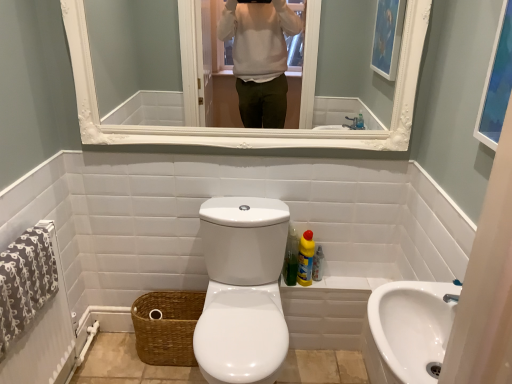
What do you see at coordinates (496, 83) in the screenshot? The height and width of the screenshot is (384, 512). I see `blue glass picture frame at upper right` at bounding box center [496, 83].

This screenshot has width=512, height=384. What do you see at coordinates (305, 259) in the screenshot? I see `yellow liquid cleaner at lower right` at bounding box center [305, 259].

Identify the location of yellow liquid cleaner at lower right. click(305, 259).

What is the approximate width of white glossy toilet at center?

white glossy toilet at center is 68.39 centimeters wide.

Where is `white glossy mirror at upper center`? white glossy mirror at upper center is located at coordinates (132, 48).

Image resolution: width=512 pixels, height=384 pixels. What do you see at coordinates (132, 48) in the screenshot?
I see `white glossy mirror at upper center` at bounding box center [132, 48].

I want to click on blue glass picture frame at upper right, so click(496, 83).

How far apart are yellow liquid cleaner at lower right and translucent plastic bottle at lower right?

3.25 inches.

Which object is wider, yellow liquid cleaner at lower right or translucent plastic bottle at lower right?

yellow liquid cleaner at lower right is wider.

Would you say yellow liquid cleaner at lower right is to the left or to the right of translucent plastic bottle at lower right in the picture?

Based on their positions, yellow liquid cleaner at lower right is located to the left of translucent plastic bottle at lower right.

From a real-world perspective, who is located higher, yellow liquid cleaner at lower right or translucent plastic bottle at lower right?

In real-world perspective, yellow liquid cleaner at lower right is above.

Relative to blue glass picture frame at upper right, is white glossy mirror at upper center in front or behind?

In the image, white glossy mirror at upper center appears behind blue glass picture frame at upper right.

Is white glossy mirror at upper center not close to blue glass picture frame at upper right?

Indeed, white glossy mirror at upper center is not near blue glass picture frame at upper right.

How many degrees apart are the facing directions of white glossy mirror at upper center and blue glass picture frame at upper right?

They differ by 90.3 degrees in their facing directions.

From the picture: Looking at their sizes, would you say white glossy mirror at upper center is wider or thinner than blue glass picture frame at upper right?

Considering their sizes, white glossy mirror at upper center looks broader than blue glass picture frame at upper right.

Is white glossy mirror at upper center with white glossy toilet at center?

white glossy mirror at upper center and white glossy toilet at center are not in contact.

The width and height of the screenshot is (512, 384). What are the coordinates of `toilet below the white glossy mirror at upper center (from the image's perspective)` in the screenshot? It's located at (242, 290).

From a real-world perspective, who is located lower, white glossy mirror at upper center or white glossy toilet at center?

white glossy toilet at center, from a real-world perspective.

Who is smaller, white glossy mirror at upper center or white glossy toilet at center?

Smaller between the two is white glossy mirror at upper center.

From their relative heights in the image, would you say white glossy mirror at upper center is taller or shorter than white glossy sink at lower right?

white glossy mirror at upper center is taller than white glossy sink at lower right.

Would you say white glossy sink at lower right is part of white glossy mirror at upper center's contents?

No, white glossy sink at lower right is located outside of white glossy mirror at upper center.

Considering the relative positions of white glossy mirror at upper center and white glossy sink at lower right in the image provided, is white glossy mirror at upper center to the left of white glossy sink at lower right from the viewer's perspective?

Yes.

Can you confirm if white glossy mirror at upper center is thinner than yellow liquid cleaner at lower right?

Correct, the width of white glossy mirror at upper center is less than that of yellow liquid cleaner at lower right.

Between white glossy mirror at upper center and yellow liquid cleaner at lower right, which one appears on the right side from the viewer's perspective?

From the viewer's perspective, yellow liquid cleaner at lower right appears more on the right side.

Can you confirm if white glossy mirror at upper center is smaller than yellow liquid cleaner at lower right?

Actually, white glossy mirror at upper center might be larger than yellow liquid cleaner at lower right.

Which object is positioned more to the left, blue glass picture frame at upper right or white glossy mirror at upper center?

From the viewer's perspective, white glossy mirror at upper center appears more on the left side.

Are blue glass picture frame at upper right and white glossy mirror at upper center located far from each other?

Absolutely, blue glass picture frame at upper right is distant from white glossy mirror at upper center.

Would you say blue glass picture frame at upper right is inside or outside white glossy mirror at upper center?

blue glass picture frame at upper right is not inside white glossy mirror at upper center, it's outside.

In terms of height, does yellow liquid cleaner at lower right look taller or shorter compared to white glossy mirror at upper center?

yellow liquid cleaner at lower right is shorter than white glossy mirror at upper center.

Is yellow liquid cleaner at lower right touching white glossy mirror at upper center?

There is a gap between yellow liquid cleaner at lower right and white glossy mirror at upper center.

Find the location of a particular element. cleaning product that appears on the right of white glossy mirror at upper center is located at coordinates (305, 259).

Does yellow liquid cleaner at lower right have a greater width compared to white glossy mirror at upper center?

Indeed, yellow liquid cleaner at lower right has a greater width compared to white glossy mirror at upper center.

You are a GUI agent. You are given a task and a screenshot of the screen. Output one action in this format:
    pyautogui.click(x=<x>, y=<y>)
    Task: Click on the toiletry on the right of yellow liquid cleaner at lower right
    
    Given the screenshot: What is the action you would take?
    pyautogui.click(x=318, y=264)

At what (x,y) coordinates should I click in order to perform the action: click on mirror that appears behind the blue glass picture frame at upper right. Please return your answer as a coordinate pair (x, y). The width and height of the screenshot is (512, 384). Looking at the image, I should click on (132, 48).

In the scene shown: Looking at the image, which one is located further to brown woven basket at lower left, white glossy toilet at center or yellow liquid cleaner at lower right?

yellow liquid cleaner at lower right lies further to brown woven basket at lower left than the other object.

Estimate the real-world distances between objects in this image. Which object is closer to yellow liquid cleaner at lower right, blue glass picture frame at upper right or white glossy sink at lower right?

white glossy sink at lower right lies closer to yellow liquid cleaner at lower right than the other object.

Looking at the image, which one is located closer to blue glass picture frame at upper right, yellow liquid cleaner at lower right or white glossy sink at lower right?

white glossy sink at lower right lies closer to blue glass picture frame at upper right than the other object.

Considering their positions, is blue glass picture frame at upper right positioned further to white glossy sink at lower right than translucent plastic bottle at lower right?

The object further to white glossy sink at lower right is translucent plastic bottle at lower right.

Estimate the real-world distances between objects in this image. Which object is closer to brown woven basket at lower left, blue glass picture frame at upper right or yellow liquid cleaner at lower right?

The object closer to brown woven basket at lower left is yellow liquid cleaner at lower right.

Consider the image. Looking at the image, which one is located closer to white glossy sink at lower right, translucent plastic bottle at lower right or blue glass picture frame at upper right?

blue glass picture frame at upper right is closer to white glossy sink at lower right.

Based on their spatial positions, is white glossy mirror at upper center or brown woven basket at lower left closer to translucent plastic bottle at lower right?

The object closer to translucent plastic bottle at lower right is brown woven basket at lower left.

Considering their positions, is brown woven basket at lower left positioned further to white glossy sink at lower right than translucent plastic bottle at lower right?

brown woven basket at lower left.

You are a GUI agent. You are given a task and a screenshot of the screen. Output one action in this format:
    pyautogui.click(x=<x>, y=<y>)
    Task: Click on the cleaning product between white glossy toilet at center and brown woven basket at lower left in the front-back direction
    The width and height of the screenshot is (512, 384).
    Given the screenshot: What is the action you would take?
    pyautogui.click(x=305, y=259)

Identify the location of toilet between blue glass picture frame at upper right and translucent plastic bottle at lower right from front to back. The height and width of the screenshot is (384, 512). (242, 290).

I want to click on toilet between white glossy sink at lower right and brown woven basket at lower left in the front-back direction, so click(242, 290).

At what (x,y) coordinates should I click in order to perform the action: click on cleaning product between white glossy sink at lower right and brown woven basket at lower left along the z-axis. Please return your answer as a coordinate pair (x, y). Image resolution: width=512 pixels, height=384 pixels. Looking at the image, I should click on (305, 259).